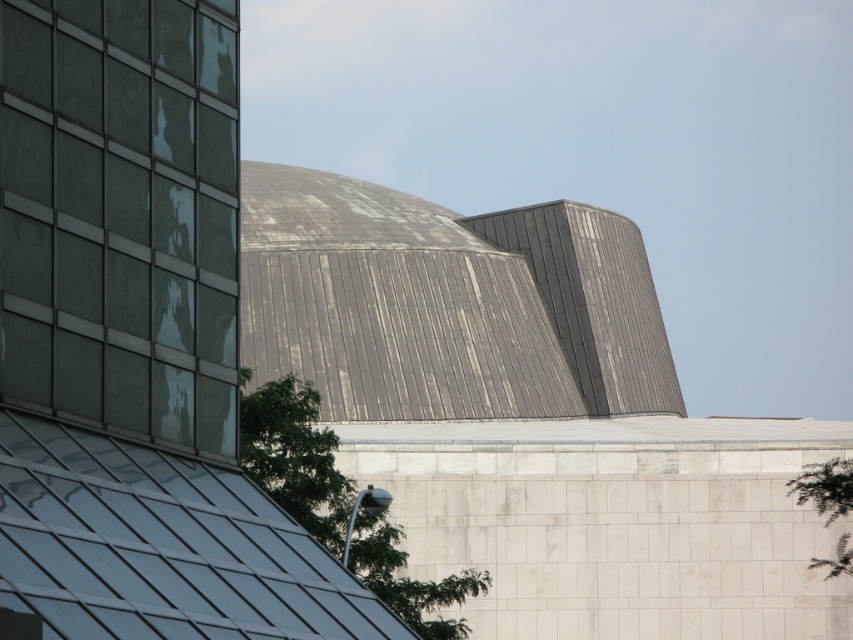
Question: Is green leafy tree at center thinner than green leafy tree at lower right?

Choices:
 (A) no
 (B) yes

Answer: (A)

Question: Can you confirm if green leafy tree at center is positioned below green leafy tree at lower right?

Choices:
 (A) yes
 (B) no

Answer: (B)

Question: Does green leafy tree at center have a smaller size compared to green leafy tree at lower right?

Choices:
 (A) yes
 (B) no

Answer: (B)

Question: Which point is closer to the camera taking this photo?

Choices:
 (A) (849, 552)
 (B) (306, 529)

Answer: (B)

Question: Which of the following is the farthest from the observer?

Choices:
 (A) (822, 500)
 (B) (260, 403)

Answer: (B)